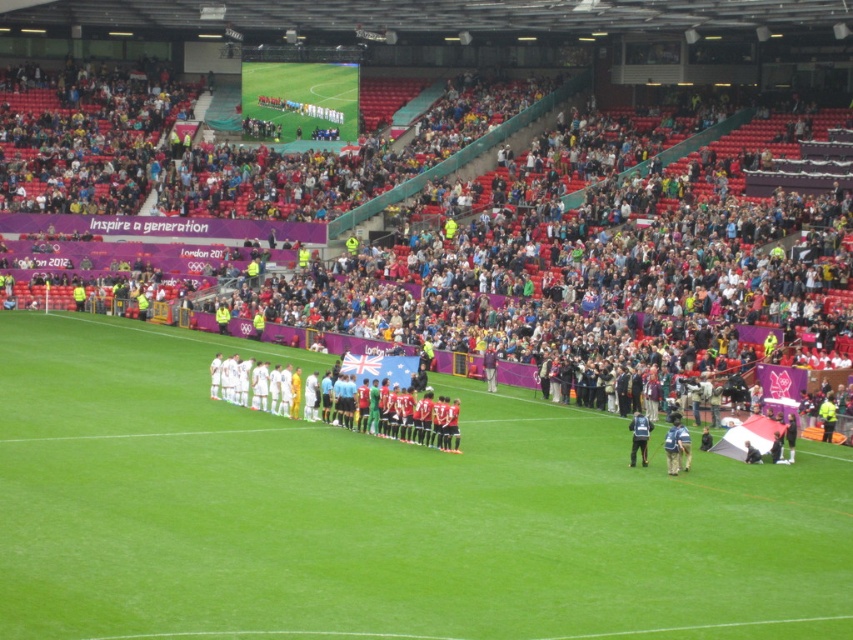
At what (x,y) coordinates should I click in order to perform the action: click on green grass football field at center. Please return your answer as a coordinate pair (x, y). Image resolution: width=853 pixels, height=640 pixels. Looking at the image, I should click on (378, 513).

Between point (697, 483) and point (637, 433), which one is positioned in front?

Point (697, 483) is more forward.

Locate an element on the screen. This screenshot has height=640, width=853. green grass football field at center is located at coordinates (378, 513).

Who is more forward, (675, 426) or (637, 435)?

Point (675, 426)

Describe the element at coordinates (676, 445) in the screenshot. I see `camouflage pants at center` at that location.

Does point (666, 451) lie in front of point (643, 452)?

Yes, it is in front of point (643, 452).

Where is `camouflage pants at center`? The height and width of the screenshot is (640, 853). camouflage pants at center is located at coordinates (676, 445).

Looking at this image, who is shorter, green grass football field at center or camouflage pants at center?

camouflage pants at center

Does green grass football field at center appear on the right side of camouflage pants at center?

No, green grass football field at center is not to the right of camouflage pants at center.

The height and width of the screenshot is (640, 853). In order to click on green grass football field at center in this screenshot , I will do click(378, 513).

Identify the location of green grass football field at center. This screenshot has width=853, height=640. (378, 513).